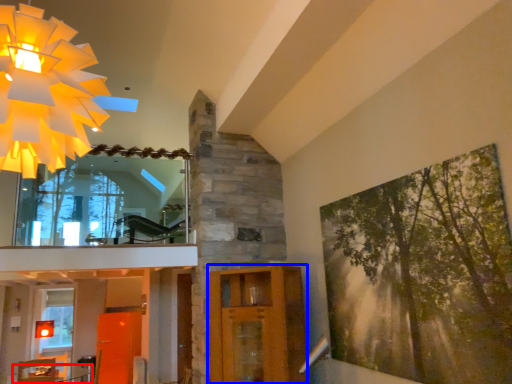
Question: Which object is further to the camera taking this photo, table (highlighted by a red box) or elevator (highlighted by a blue box)?

Choices:
 (A) table
 (B) elevator

Answer: (A)